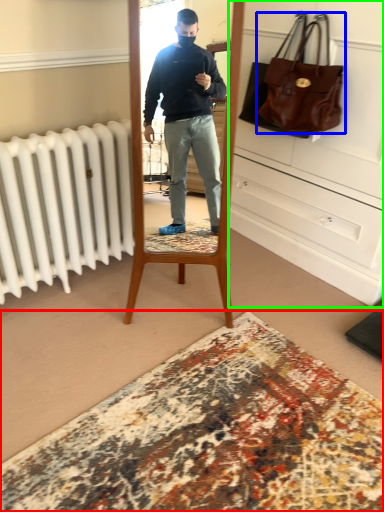
Question: Which is nearer to the plain (highlighted by a red box)? handbag (highlighted by a blue box) or dresser (highlighted by a green box).

Choices:
 (A) handbag
 (B) dresser

Answer: (B)